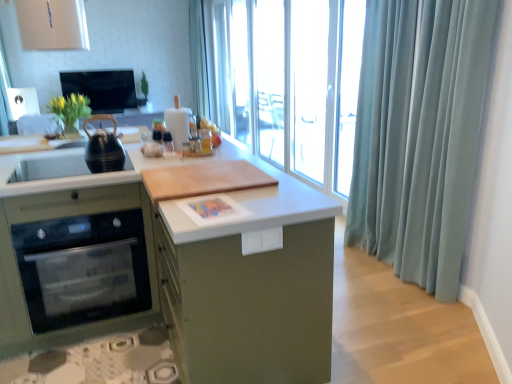
Question: From a real-world perspective, is satin blue curtain at right, placed as the second shower curtain when sorted from top to bottom, located higher than black matte kettle at left?

Choices:
 (A) no
 (B) yes

Answer: (A)

Question: Is satin blue curtain at right, the 1th shower curtain in the right-to-left sequence, in contact with black matte kettle at left?

Choices:
 (A) no
 (B) yes

Answer: (A)

Question: From the image's perspective, is satin blue curtain at right, the 2th shower curtain in the left-to-right sequence, beneath black matte kettle at left?

Choices:
 (A) no
 (B) yes

Answer: (B)

Question: Considering the relative sizes of satin blue curtain at right, the 2th shower curtain in the left-to-right sequence, and black matte kettle at left in the image provided, is satin blue curtain at right, the 2th shower curtain in the left-to-right sequence, smaller than black matte kettle at left?

Choices:
 (A) yes
 (B) no

Answer: (B)

Question: From a real-world perspective, is satin blue curtain at right, which appears as the 1th shower curtain when ordered from the bottom, below black matte kettle at left?

Choices:
 (A) yes
 (B) no

Answer: (A)

Question: Is satin blue curtain at right, placed as the second shower curtain when sorted from top to bottom, far away from black matte kettle at left?

Choices:
 (A) yes
 (B) no

Answer: (A)

Question: From a real-world perspective, is black matte kettle at left positioned under matte black oven at left based on gravity?

Choices:
 (A) no
 (B) yes

Answer: (A)

Question: Could you tell me if black matte kettle at left is turned towards matte black oven at left?

Choices:
 (A) yes
 (B) no

Answer: (B)

Question: Is black matte kettle at left taller than matte black oven at left?

Choices:
 (A) no
 (B) yes

Answer: (A)

Question: Does black matte kettle at left come behind matte black oven at left?

Choices:
 (A) yes
 (B) no

Answer: (A)

Question: Would you say black matte kettle at left is outside matte black oven at left?

Choices:
 (A) yes
 (B) no

Answer: (A)

Question: Considering the relative positions of black matte kettle at left and matte black oven at left in the image provided, is black matte kettle at left in front of matte black oven at left?

Choices:
 (A) yes
 (B) no

Answer: (B)

Question: Is black matte kettle at left not inside light blue fabric at upper center, arranged as the second shower curtain when viewed from the right?

Choices:
 (A) yes
 (B) no

Answer: (A)